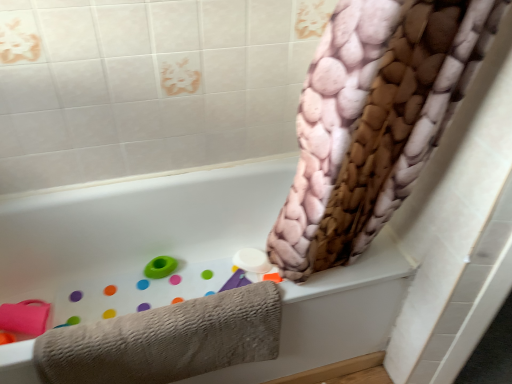
Question: Is beige textured towel at lower left thinner than green rubber ring at lower left?

Choices:
 (A) no
 (B) yes

Answer: (A)

Question: Would you say beige textured towel at lower left is outside green rubber ring at lower left?

Choices:
 (A) yes
 (B) no

Answer: (A)

Question: Can you confirm if beige textured towel at lower left is positioned to the right of green rubber ring at lower left?

Choices:
 (A) no
 (B) yes

Answer: (B)

Question: Can you confirm if beige textured towel at lower left is positioned to the left of green rubber ring at lower left?

Choices:
 (A) no
 (B) yes

Answer: (A)

Question: From a real-world perspective, is beige textured towel at lower left located beneath green rubber ring at lower left?

Choices:
 (A) no
 (B) yes

Answer: (A)

Question: From the image's perspective, is beige textured towel at lower left on top of green rubber ring at lower left?

Choices:
 (A) yes
 (B) no

Answer: (B)

Question: Does beige textured towel at lower left appear on the right side of white matte bathtub at upper center?

Choices:
 (A) no
 (B) yes

Answer: (B)

Question: Is beige textured towel at lower left not inside white matte bathtub at upper center?

Choices:
 (A) yes
 (B) no

Answer: (B)

Question: From the image's perspective, is beige textured towel at lower left on top of white matte bathtub at upper center?

Choices:
 (A) yes
 (B) no

Answer: (B)

Question: From a real-world perspective, is beige textured towel at lower left on white matte bathtub at upper center?

Choices:
 (A) yes
 (B) no

Answer: (A)

Question: Is beige textured towel at lower left smaller than white matte bathtub at upper center?

Choices:
 (A) yes
 (B) no

Answer: (A)

Question: Considering the relative sizes of beige textured towel at lower left and white matte bathtub at upper center in the image provided, is beige textured towel at lower left taller than white matte bathtub at upper center?

Choices:
 (A) yes
 (B) no

Answer: (B)

Question: From a real-world perspective, is green rubber ring at lower left physically below beige textured towel at lower left?

Choices:
 (A) no
 (B) yes

Answer: (B)